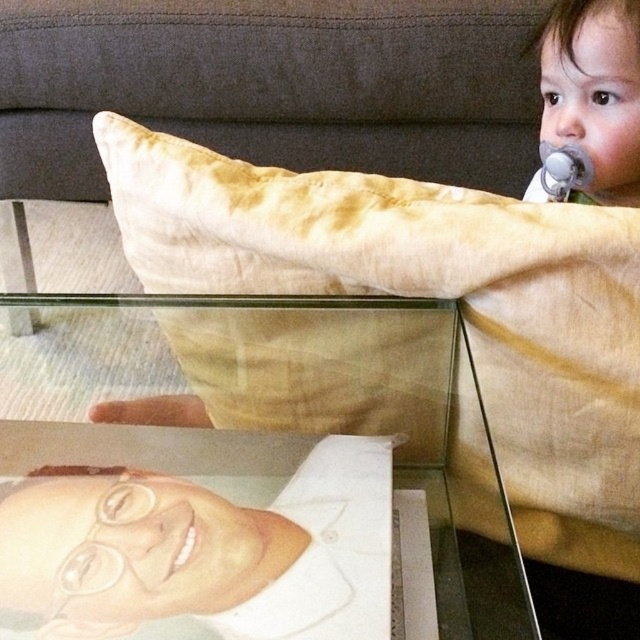
What do you see at coordinates (432, 296) in the screenshot?
I see `beige cotton pillow at upper center` at bounding box center [432, 296].

Is beige cotton pillow at upper center to the right of white matte mouth at lower center from the viewer's perspective?

Yes, beige cotton pillow at upper center is to the right of white matte mouth at lower center.

Does point (563, 368) come farther from viewer compared to point (186, 554)?

That is True.

Where is `beige cotton pillow at upper center`? beige cotton pillow at upper center is located at coordinates (432, 296).

Is point (16, 346) in front of point (186, 544)?

No.

Between transparent glass portrait at lower left and white matte mouth at lower center, which one appears on the right side from the viewer's perspective?

From the viewer's perspective, white matte mouth at lower center appears more on the right side.

This screenshot has height=640, width=640. I want to click on transparent glass portrait at lower left, so click(x=280, y=412).

Is smooth skin toddler at upper right smaller than white matte mouth at lower center?

No.

Does point (628, 51) come farther from viewer compared to point (186, 550)?

Yes, it is behind point (186, 550).

What do you see at coordinates (595, 90) in the screenshot?
I see `smooth skin toddler at upper right` at bounding box center [595, 90].

Where is `smooth skin toddler at upper right`? smooth skin toddler at upper right is located at coordinates (595, 90).